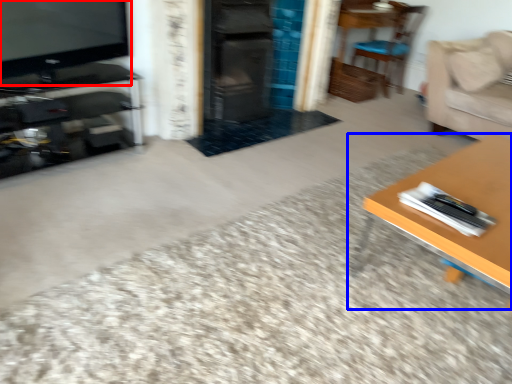
Question: Which of the following is the closest to the observer, television (highlighted by a red box) or table (highlighted by a blue box)?

Choices:
 (A) television
 (B) table

Answer: (B)